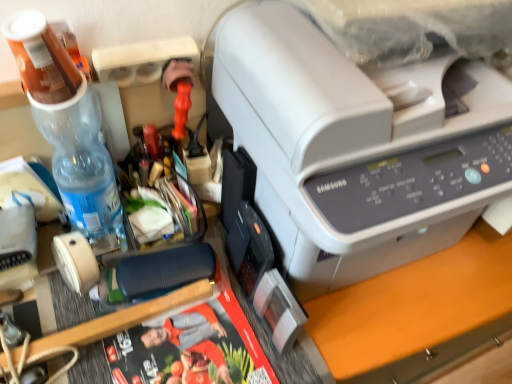
What do you see at coordinates (41, 58) in the screenshot? Image resolution: width=512 pixels, height=384 pixels. I see `translucent plastic bottle at upper left` at bounding box center [41, 58].

Identify the location of beige matte tape at lower left. The height and width of the screenshot is (384, 512). (75, 261).

From the image's perspective, is matte black magazine at center under beige matte tape at lower left?

Yes, from the image's perspective, matte black magazine at center is beneath beige matte tape at lower left.

Is matte black magazine at center at the left side of beige matte tape at lower left?

No, matte black magazine at center is not to the left of beige matte tape at lower left.

I want to click on magazine below the beige matte tape at lower left (from a real-world perspective), so click(191, 348).

Considering the sizes of matte black magazine at center and beige matte tape at lower left in the image, is matte black magazine at center taller or shorter than beige matte tape at lower left?

matte black magazine at center is shorter than beige matte tape at lower left.

Locate an element on the screen. This screenshot has width=512, height=384. magazine on the left of white plastic printer at upper right is located at coordinates (191, 348).

Which of these two, matte black magazine at center or white plastic printer at upper right, stands shorter?

matte black magazine at center is shorter.

Which object is closer to the camera taking this photo, matte black magazine at center or white plastic printer at upper right?

white plastic printer at upper right is more forward.

From the image's perspective, is translucent plastic bottle at upper left located above or below beige matte tape at lower left?

From the image's perspective, translucent plastic bottle at upper left appears above beige matte tape at lower left.

Can you confirm if translucent plastic bottle at upper left is shorter than beige matte tape at lower left?

In fact, translucent plastic bottle at upper left may be taller than beige matte tape at lower left.

Considering the sizes of objects translucent plastic bottle at upper left and beige matte tape at lower left in the image provided, who is wider, translucent plastic bottle at upper left or beige matte tape at lower left?

With larger width is translucent plastic bottle at upper left.

Is translucent plastic bottle at upper left further to the viewer compared to beige matte tape at lower left?

No, the depth of translucent plastic bottle at upper left is less than that of beige matte tape at lower left.

Does beige matte tape at lower left have a greater width compared to clear plastic bottle at left?

No, beige matte tape at lower left is not wider than clear plastic bottle at left.

Is point (70, 269) positioned after point (60, 187)?

That is False.

Between beige matte tape at lower left and clear plastic bottle at left, which one appears on the right side from the viewer's perspective?

clear plastic bottle at left is more to the right.

Looking at this image, is beige matte tape at lower left aimed at clear plastic bottle at left?

No, beige matte tape at lower left is not aimed at clear plastic bottle at left.

Who is shorter, white plastic printer at upper right or matte black magazine at center?

matte black magazine at center is shorter.

Is white plastic printer at upper right not within matte black magazine at center?

Absolutely, white plastic printer at upper right is external to matte black magazine at center.

Is white plastic printer at upper right oriented towards matte black magazine at center?

No, white plastic printer at upper right does not turn towards matte black magazine at center.

Would you say white plastic printer at upper right is a long distance from matte black magazine at center?

No.

Is translucent plastic bottle at upper left taller than clear plastic bottle at left?

No, translucent plastic bottle at upper left is not taller than clear plastic bottle at left.

How distant is translucent plastic bottle at upper left from clear plastic bottle at left?

A distance of 3.12 inches exists between translucent plastic bottle at upper left and clear plastic bottle at left.

You are a GUI agent. You are given a task and a screenshot of the screen. Output one action in this format:
    pyautogui.click(x=<x>, y=<y>)
    Task: Click on the stationery located above the clear plastic bottle at left (from the image's perspective)
    The width and height of the screenshot is (512, 384).
    Given the screenshot: What is the action you would take?
    pyautogui.click(x=41, y=58)

Consider the image. Is white plastic printer at upper right in front of translucent plastic bottle at upper left?

Yes, it is.

Is white plastic printer at upper right looking in the opposite direction of translucent plastic bottle at upper left?

No, white plastic printer at upper right is not facing away from translucent plastic bottle at upper left.

Is white plastic printer at upper right not near translucent plastic bottle at upper left?

No.

Between white plastic printer at upper right and translucent plastic bottle at upper left, which one has smaller width?

translucent plastic bottle at upper left is thinner.

Find the location of a particular element. The height and width of the screenshot is (384, 512). magazine that is under the beige matte tape at lower left (from a real-world perspective) is located at coordinates (191, 348).

Locate an element on the screen. The width and height of the screenshot is (512, 384). printer that is in front of the matte black magazine at center is located at coordinates (357, 146).

Consider the image. From the image, which object appears to be farther from translucent plastic bottle at upper left, white plastic printer at upper right or beige matte tape at lower left?

Based on the image, white plastic printer at upper right appears to be further to translucent plastic bottle at upper left.

Which object lies nearer to the anchor point clear plastic bottle at left, beige matte tape at lower left or translucent plastic bottle at upper left?

translucent plastic bottle at upper left.

Estimate the real-world distances between objects in this image. Which object is further from matte black magazine at center, clear plastic bottle at left or translucent plastic bottle at upper left?

translucent plastic bottle at upper left is further to matte black magazine at center.

Looking at the image, which one is located closer to white plastic printer at upper right, clear plastic bottle at left or beige matte tape at lower left?

clear plastic bottle at left is positioned closer to the anchor white plastic printer at upper right.

Considering their positions, is clear plastic bottle at left positioned further to white plastic printer at upper right than translucent plastic bottle at upper left?

translucent plastic bottle at upper left lies further to white plastic printer at upper right than the other object.

Based on their spatial positions, is matte black magazine at center or white plastic printer at upper right further from beige matte tape at lower left?

white plastic printer at upper right.

In the scene shown: Considering their positions, is translucent plastic bottle at upper left positioned further to clear plastic bottle at left than beige matte tape at lower left?

beige matte tape at lower left lies further to clear plastic bottle at left than the other object.

From the image, which object appears to be farther from translucent plastic bottle at upper left, beige matte tape at lower left or matte black magazine at center?

Based on the image, matte black magazine at center appears to be further to translucent plastic bottle at upper left.

Identify the location of bottle between translucent plastic bottle at upper left and beige matte tape at lower left in the vertical direction. (68, 126).

This screenshot has width=512, height=384. Identify the location of bottle between beige matte tape at lower left and white plastic printer at upper right. click(68, 126).

I want to click on tape between translucent plastic bottle at upper left and matte black magazine at center in the vertical direction, so click(75, 261).

Identify the location of magazine located between clear plastic bottle at left and white plastic printer at upper right in the left-right direction. (191, 348).